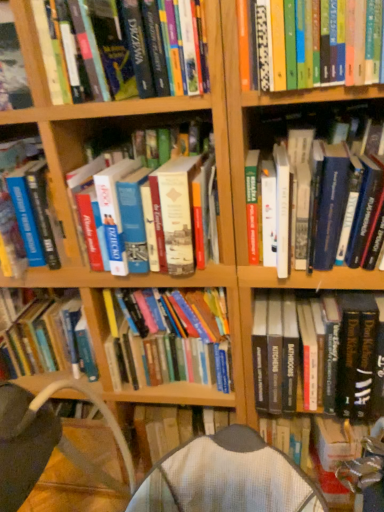
Where is `hardcover book at lower right, the 1th book positioned from the right`? The width and height of the screenshot is (384, 512). hardcover book at lower right, the 1th book positioned from the right is located at coordinates (323, 356).

Describe the element at coordinates (315, 165) in the screenshot. I see `hardcover book at center, which appears as the 2th book when viewed from the right` at that location.

How much space does hardcover book at upper left, which ranks as the second book in left-to-right order, occupy vertically?

It is 8.67 inches.

Where is `hardcover book at center, arranged as the 4th book when viewed from the right`? The width and height of the screenshot is (384, 512). hardcover book at center, arranged as the 4th book when viewed from the right is located at coordinates (170, 339).

Find the location of a particular element. This screenshot has width=384, height=512. book that is the 4th one below the hardcover book at upper left, acting as the 6th book starting from the right (from a real-world perspective) is located at coordinates coord(112,211).

Which is in front, point (174, 7) or point (102, 182)?

Point (174, 7)

Considering the positions of objects hardcover book at upper left, acting as the 6th book starting from the right, and hardcover book at center, which is the fifth book from right to left, in the image provided, who is behind, hardcover book at upper left, acting as the 6th book starting from the right, or hardcover book at center, which is the fifth book from right to left,?

hardcover book at center, which is the fifth book from right to left, is further away from the camera.

Could you tell me if hardcover book at upper left, which ranks as the second book in left-to-right order, is facing hardcover book at center, positioned as the 3th book in left-to-right order?

No, hardcover book at upper left, which ranks as the second book in left-to-right order, is not aimed at hardcover book at center, positioned as the 3th book in left-to-right order.

Between hardcover book at center, which appears as the 6th book when viewed from the left, and hardcover book at center, which is the fourth book from left to right, which one is positioned behind?

hardcover book at center, which is the fourth book from left to right, is behind.

Considering the positions of points (322, 218) and (177, 343), is point (322, 218) farther from camera compared to point (177, 343)?

No, (322, 218) is in front of (177, 343).

Considering the positions of objects hardcover book at center, which appears as the 6th book when viewed from the left, and hardcover book at center, which is the fourth book from left to right, in the image provided, who is more to the right, hardcover book at center, which appears as the 6th book when viewed from the left, or hardcover book at center, which is the fourth book from left to right,?

Positioned to the right is hardcover book at center, which appears as the 6th book when viewed from the left.

Is hardcover book at center, which appears as the 6th book when viewed from the left, surrounding hardcover book at center, which is the fourth book from left to right?

No, hardcover book at center, which is the fourth book from left to right, is not a part of hardcover book at center, which appears as the 6th book when viewed from the left.

Considering the relative sizes of hardcover book at center, which appears as the 6th book when viewed from the left, and hardcover book at upper right, which is the third book in right-to-left order, in the image provided, is hardcover book at center, which appears as the 6th book when viewed from the left, smaller than hardcover book at upper right, which is the third book in right-to-left order,?

No.

From a real-world perspective, between hardcover book at center, which appears as the 2th book when viewed from the right, and hardcover book at upper right, which appears as the 5th book when viewed from the left, who is vertically higher?

From a 3D spatial view, hardcover book at upper right, which appears as the 5th book when viewed from the left, is above.

Which object is wider, hardcover book at center, which appears as the 6th book when viewed from the left, or hardcover book at upper right, which appears as the 5th book when viewed from the left?

hardcover book at upper right, which appears as the 5th book when viewed from the left.

From the image's perspective, which is above, hardcover book at center, which appears as the 2th book when viewed from the right, or hardcover book at upper right, which is the third book in right-to-left order?

hardcover book at upper right, which is the third book in right-to-left order, from the image's perspective.

From the image's perspective, between hardcover book at upper right, which is the third book in right-to-left order, and hardcover book at left, the seventh book from the right, who is located below?

From the image's view, hardcover book at left, the seventh book from the right, is below.

Is hardcover book at upper right, which is the third book in right-to-left order, oriented towards hardcover book at left, the first book viewed from the left?

No, hardcover book at upper right, which is the third book in right-to-left order, is not oriented towards hardcover book at left, the first book viewed from the left.

Starting from the hardcover book at upper right, which appears as the 5th book when viewed from the left, which book is the 4th one behind? Please provide its 2D coordinates.

[(35, 207)]

Looking at this image, how different are the orientations of hardcover book at upper right, which is the third book in right-to-left order, and hardcover book at left, the seventh book from the right, in degrees?

The facing directions of hardcover book at upper right, which is the third book in right-to-left order, and hardcover book at left, the seventh book from the right, are 0.000426 degrees apart.

In the scene shown: From the image's perspective, relative to hardcover book at center, which is the fourth book from left to right, is hardcover book at upper left, acting as the 6th book starting from the right, above or below?

Clearly, from the image's perspective, hardcover book at upper left, acting as the 6th book starting from the right, is above hardcover book at center, which is the fourth book from left to right.

Does point (64, 81) come closer to viewer compared to point (200, 329)?

Yes.

Considering the sizes of objects hardcover book at upper left, acting as the 6th book starting from the right, and hardcover book at center, arranged as the 4th book when viewed from the right, in the image provided, who is shorter, hardcover book at upper left, acting as the 6th book starting from the right, or hardcover book at center, arranged as the 4th book when viewed from the right,?

Standing shorter between the two is hardcover book at upper left, acting as the 6th book starting from the right.

Between hardcover book at upper right, which appears as the 5th book when viewed from the left, and hardcover book at center, which is the fourth book from left to right, which one appears on the right side from the viewer's perspective?

hardcover book at upper right, which appears as the 5th book when viewed from the left, is more to the right.

Which is correct: hardcover book at upper right, which is the third book in right-to-left order, is inside hardcover book at center, arranged as the 4th book when viewed from the right, or outside of it?

hardcover book at upper right, which is the third book in right-to-left order, is located beyond the bounds of hardcover book at center, arranged as the 4th book when viewed from the right.

Between hardcover book at upper left, which ranks as the second book in left-to-right order, and hardcover book at upper right, which is the third book in right-to-left order, which one appears on the right side from the viewer's perspective?

A: hardcover book at upper right, which is the third book in right-to-left order.

Which is correct: hardcover book at upper left, acting as the 6th book starting from the right, is inside hardcover book at upper right, which is the third book in right-to-left order, or outside of it?

The correct answer is: outside.

Is hardcover book at upper left, which ranks as the second book in left-to-right order, beside hardcover book at upper right, which is the third book in right-to-left order?

No, hardcover book at upper left, which ranks as the second book in left-to-right order, is not in contact with hardcover book at upper right, which is the third book in right-to-left order.

Locate an element on the screen. The height and width of the screenshot is (512, 384). book that is the 2nd object located behind the hardcover book at upper left, acting as the 6th book starting from the right is located at coordinates (112, 211).

Starting from the hardcover book at center, which is the fourth book from left to right, which book is the 4th one in front? Please provide its 2D coordinates.

[(315, 165)]

Estimate the real-world distances between objects in this image. Which object is further from hardcover book at upper left, acting as the 6th book starting from the right, hardcover book at lower right, the 1th book positioned from the right, or hardcover book at center, which is the fifth book from right to left?

The object further to hardcover book at upper left, acting as the 6th book starting from the right, is hardcover book at lower right, the 1th book positioned from the right.

Considering their positions, is hardcover book at left, the first book viewed from the left, positioned closer to hardcover book at center, which appears as the 2th book when viewed from the right, than hardcover book at upper left, acting as the 6th book starting from the right?

hardcover book at upper left, acting as the 6th book starting from the right, lies closer to hardcover book at center, which appears as the 2th book when viewed from the right, than the other object.

Looking at the image, which one is located further to hardcover book at left, the first book viewed from the left, hardcover book at upper right, which appears as the 5th book when viewed from the left, or hardcover book at center, which is the fourth book from left to right?

hardcover book at upper right, which appears as the 5th book when viewed from the left, lies further to hardcover book at left, the first book viewed from the left, than the other object.

Based on their spatial positions, is hardcover book at center, which is the fourth book from left to right, or hardcover book at center, positioned as the 3th book in left-to-right order, closer to hardcover book at center, which appears as the 6th book when viewed from the left?

The object closer to hardcover book at center, which appears as the 6th book when viewed from the left, is hardcover book at center, positioned as the 3th book in left-to-right order.

When comparing their distances from hardcover book at left, the first book viewed from the left, does hardcover book at lower right, the 1th book positioned from the right, or hardcover book at center, which is the fifth book from right to left, seem further?

The object further to hardcover book at left, the first book viewed from the left, is hardcover book at lower right, the 1th book positioned from the right.

Based on their spatial positions, is hardcover book at lower right, the 1th book positioned from the right, or hardcover book at center, which appears as the 2th book when viewed from the right, further from hardcover book at upper left, which ranks as the second book in left-to-right order?

Based on the image, hardcover book at lower right, the 1th book positioned from the right, appears to be further to hardcover book at upper left, which ranks as the second book in left-to-right order.

When comparing their distances from hardcover book at left, the first book viewed from the left, does hardcover book at center, which appears as the 2th book when viewed from the right, or hardcover book at lower right, acting as the seventh book starting from the left, seem further?

hardcover book at lower right, acting as the seventh book starting from the left, is positioned further to the anchor hardcover book at left, the first book viewed from the left.

Estimate the real-world distances between objects in this image. Which object is further from hardcover book at upper right, which appears as the 5th book when viewed from the left, hardcover book at center, which appears as the 6th book when viewed from the left, or hardcover book at lower right, the 1th book positioned from the right?

Among the two, hardcover book at lower right, the 1th book positioned from the right, is located further to hardcover book at upper right, which appears as the 5th book when viewed from the left.

This screenshot has height=512, width=384. Find the location of `book located between hardcover book at left, the seventh book from the right, and hardcover book at center, which is the fifth book from right to left, in the left-right direction`. book located between hardcover book at left, the seventh book from the right, and hardcover book at center, which is the fifth book from right to left, in the left-right direction is located at coordinates (124, 48).